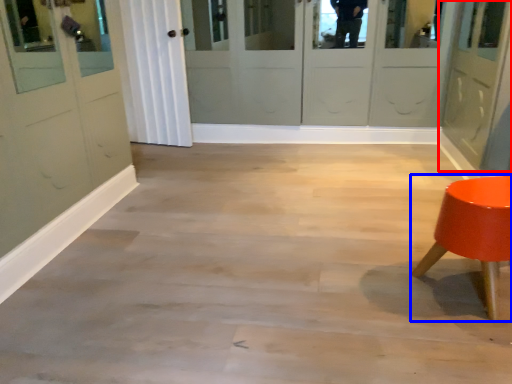
Question: Which point is further to the camera, door (highlighted by a red box) or furniture (highlighted by a blue box)?

Choices:
 (A) door
 (B) furniture

Answer: (A)